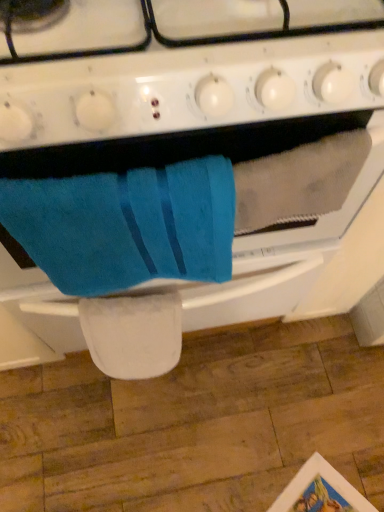
Question: Does white glossy gas stove at upper center have a lesser height compared to blue soft towel at center?

Choices:
 (A) yes
 (B) no

Answer: (A)

Question: From a real-world perspective, is white glossy gas stove at upper center over blue soft towel at center?

Choices:
 (A) no
 (B) yes

Answer: (B)

Question: Is blue soft towel at center located within white glossy gas stove at upper center?

Choices:
 (A) no
 (B) yes

Answer: (A)

Question: Considering the relative positions of white glossy gas stove at upper center and blue soft towel at center in the image provided, is white glossy gas stove at upper center to the right of blue soft towel at center from the viewer's perspective?

Choices:
 (A) no
 (B) yes

Answer: (B)

Question: Is white glossy gas stove at upper center oriented towards blue soft towel at center?

Choices:
 (A) no
 (B) yes

Answer: (A)

Question: Can you confirm if white glossy gas stove at upper center is thinner than blue soft towel at center?

Choices:
 (A) no
 (B) yes

Answer: (A)

Question: From a real-world perspective, is blue soft towel at center located higher than blue terry cloth towel at center?

Choices:
 (A) yes
 (B) no

Answer: (A)

Question: Is blue soft towel at center thinner than blue terry cloth towel at center?

Choices:
 (A) no
 (B) yes

Answer: (B)

Question: Is blue soft towel at center further to camera compared to blue terry cloth towel at center?

Choices:
 (A) yes
 (B) no

Answer: (A)

Question: Is blue soft towel at center bigger than blue terry cloth towel at center?

Choices:
 (A) yes
 (B) no

Answer: (B)

Question: Is blue soft towel at center aimed at blue terry cloth towel at center?

Choices:
 (A) no
 (B) yes

Answer: (B)

Question: From the image's perspective, is blue soft towel at center located above blue terry cloth towel at center?

Choices:
 (A) no
 (B) yes

Answer: (A)

Question: Considering the relative positions of blue terry cloth towel at center and white glossy gas stove at upper center in the image provided, is blue terry cloth towel at center in front of white glossy gas stove at upper center?

Choices:
 (A) no
 (B) yes

Answer: (A)